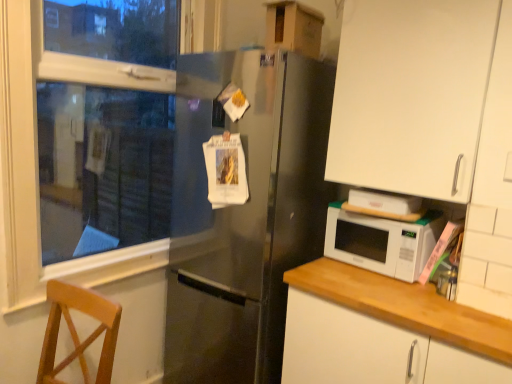
Question: Do you think white matte cabinet at right, the 2th cabinetry in the top-to-bottom sequence, is within white glossy microwave at lower right, or outside of it?

Choices:
 (A) outside
 (B) inside

Answer: (A)

Question: Considering the positions of white matte cabinet at right, the 2th cabinetry in the top-to-bottom sequence, and white glossy microwave at lower right in the image, is white matte cabinet at right, the 2th cabinetry in the top-to-bottom sequence, bigger or smaller than white glossy microwave at lower right?

Choices:
 (A) small
 (B) big

Answer: (B)

Question: Which object is positioned farthest from the wooden chair at lower left?

Choices:
 (A) white matte cabinet at upper right, marked as the second cabinetry in a bottom-to-top arrangement
 (B) white matte cabinet at right, which appears as the 1th cabinetry when ordered from the bottom
 (C) satin black refrigerator at center
 (D) white glossy microwave at lower right
 (E) white plastic window frame at left

Answer: (A)

Question: Which object is positioned farthest from the white glossy microwave at lower right?

Choices:
 (A) wooden chair at lower left
 (B) white plastic window frame at left
 (C) satin black refrigerator at center
 (D) white matte cabinet at upper right, the first cabinetry from the top
 (E) white matte cabinet at right, the 2th cabinetry in the top-to-bottom sequence

Answer: (B)